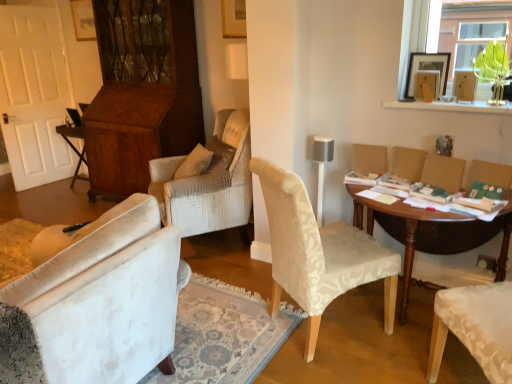
I want to click on vacant space situated above wooden table at center, which is counted as the first table, starting from the right (from a real-world perspective), so click(422, 199).